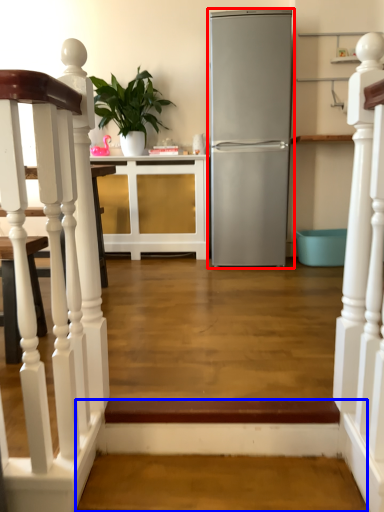
Question: Which object appears closest to the camera in this image, refrigerator (highlighted by a red box) or stairwell (highlighted by a blue box)?

Choices:
 (A) refrigerator
 (B) stairwell

Answer: (B)